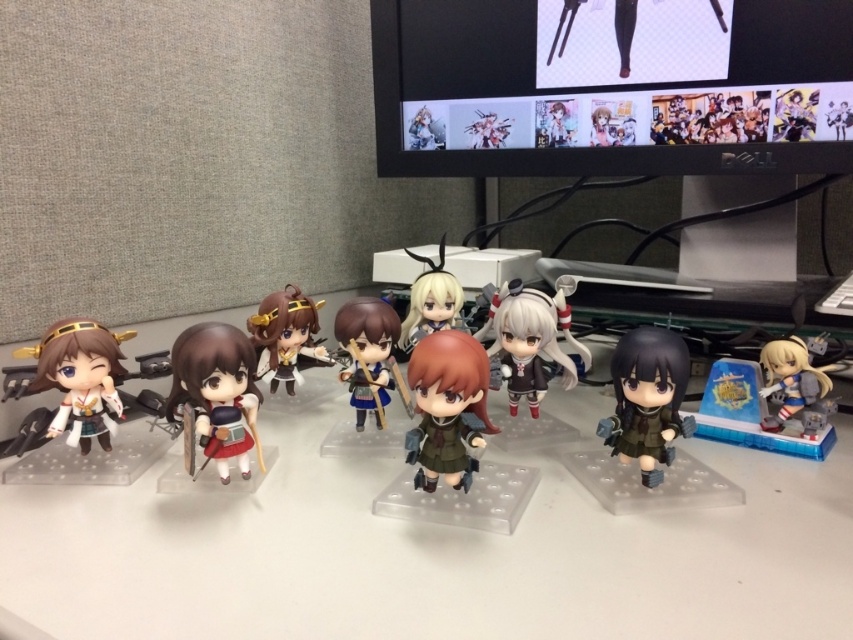
You are organizing a display of figurines on a narrow shelf. You have the matte green fabric figurine at center and the matte gold hairpin at center. Which object should you place first to ensure they both fit on the shelf without overlapping?

The matte green fabric figurine at center should be placed first since it is thinner than the matte gold hairpin at center, allowing more space for the wider hairpin to fit alongside without overlapping.

You are organizing a display of figurines on a desk. You have a matte black figure at lower right and a matte white doll at center. Which figurine is shorter?

The matte black figure at lower right is shorter than the matte white doll at center.